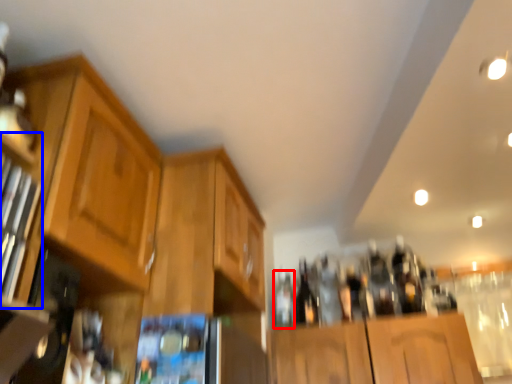
Question: Which point is closer to the camera, bottle (highlighted by a red box) or shelf (highlighted by a blue box)?

Choices:
 (A) bottle
 (B) shelf

Answer: (B)